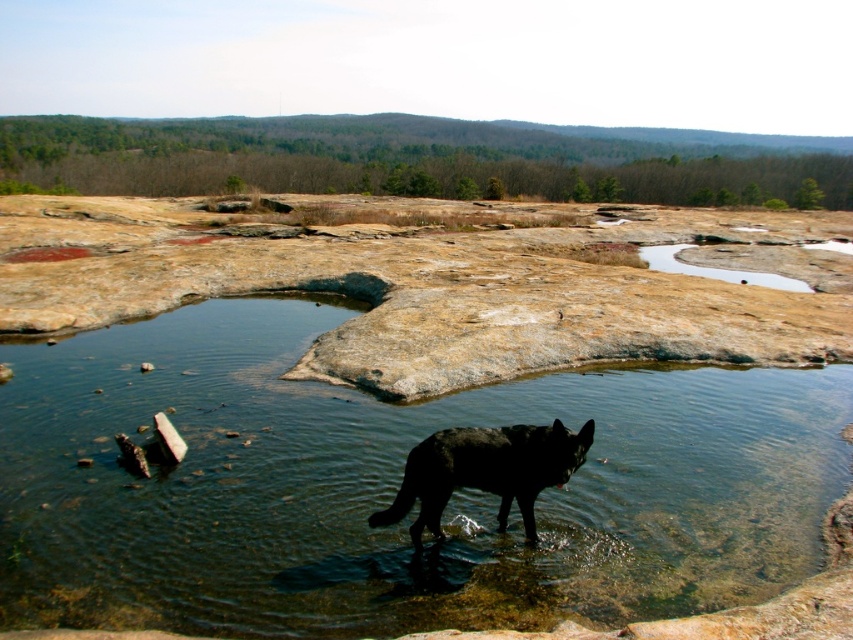
You are standing at the edge of the rocky terrain and want to approach the black fur dog at lower center without stepping into the clear water at center. Which direction should you walk to reach the dog?

You should walk to the right side of the clear water at center to avoid stepping into it, as the black fur dog at lower center is located to the right of the clear water at center according to the description.

You are a hiker who wants to cross the clear water at center to reach the other side. The black fur dog at lower center is standing in the water. Can the dog help you determine if the water is safe to cross?

The clear water at center has a larger size compared to black fur dog at lower center, which means the water depth might be deeper than the dog, so the dog might not be a reliable indicator of safe crossing depth. Proceed with caution.